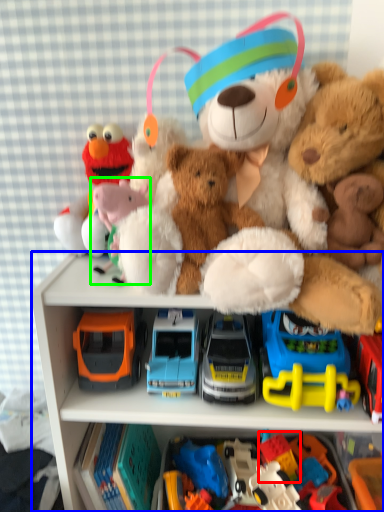
Question: Considering the real-world distances, which object is closest to toy (highlighted by a red box)? cabinetry (highlighted by a blue box) or toy (highlighted by a green box).

Choices:
 (A) cabinetry
 (B) toy

Answer: (A)